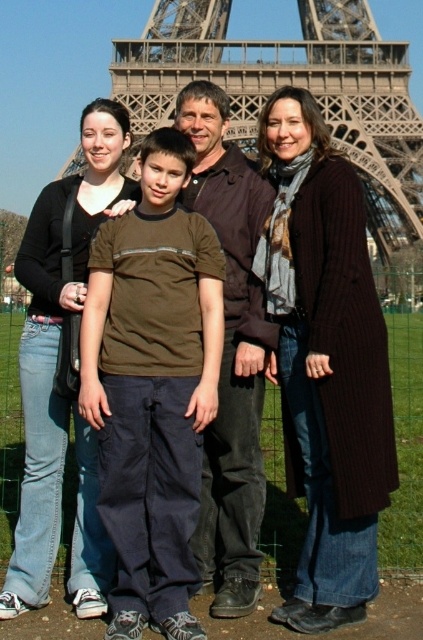
Does brown cotton shirt at center have a larger size compared to metallic structure at center?

No, brown cotton shirt at center is not bigger than metallic structure at center.

This screenshot has width=423, height=640. Identify the location of brown cotton shirt at center. (153, 387).

I want to click on brown cotton shirt at center, so click(x=153, y=387).

Is brown cotton shirt at center shorter than jeans at left?

Correct, brown cotton shirt at center is not as tall as jeans at left.

Can you confirm if brown cotton shirt at center is smaller than jeans at left?

Indeed, brown cotton shirt at center has a smaller size compared to jeans at left.

Between point (139, 218) and point (80, 548), which one is positioned in front?

Point (80, 548) is in front.

This screenshot has height=640, width=423. Find the location of `brown cotton shirt at center`. brown cotton shirt at center is located at coordinates click(153, 387).

Is brown wool coat at center smaller than jeans at left?

No, brown wool coat at center is not smaller than jeans at left.

Can you confirm if brown wool coat at center is bigger than jeans at left?

Yes.

Is point (362, 566) farther from viewer compared to point (129, 195)?

No, (362, 566) is in front of (129, 195).

Image resolution: width=423 pixels, height=640 pixels. Find the location of `brown wool coat at center`. brown wool coat at center is located at coordinates (326, 362).